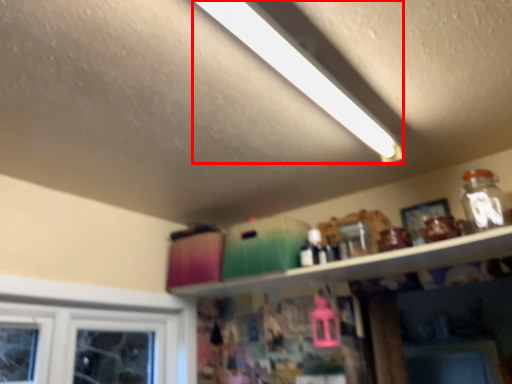
Question: From the image's perspective, what is the correct spatial positioning of light (annotated by the red box) in reference to shelf?

Choices:
 (A) above
 (B) below

Answer: (A)